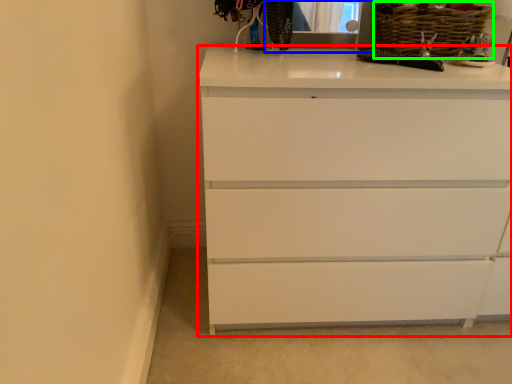
Question: Based on their relative distances, which object is farther from chest of drawers (highlighted by a red box)? Choose from medicine cabinet (highlighted by a blue box) and basket (highlighted by a green box).

Choices:
 (A) medicine cabinet
 (B) basket

Answer: (A)